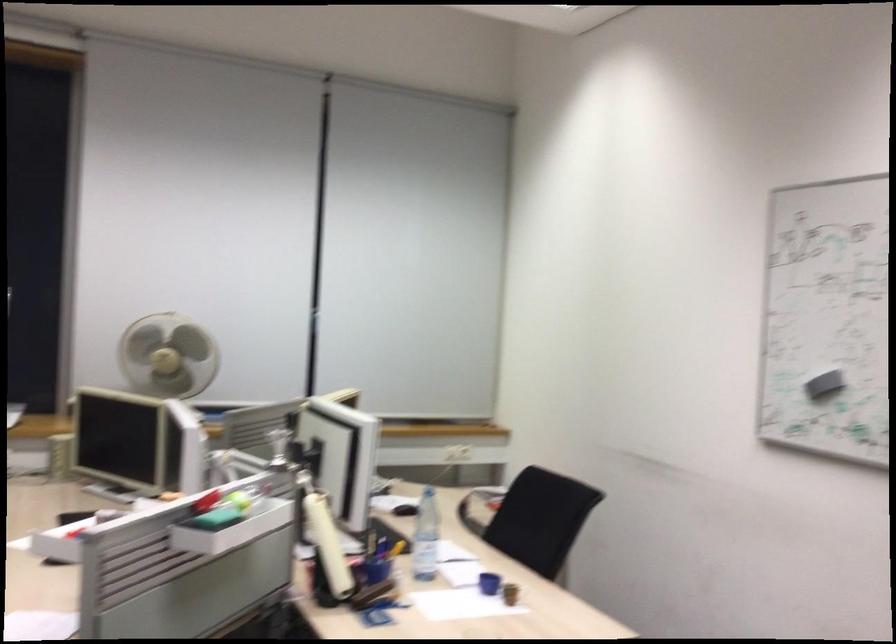
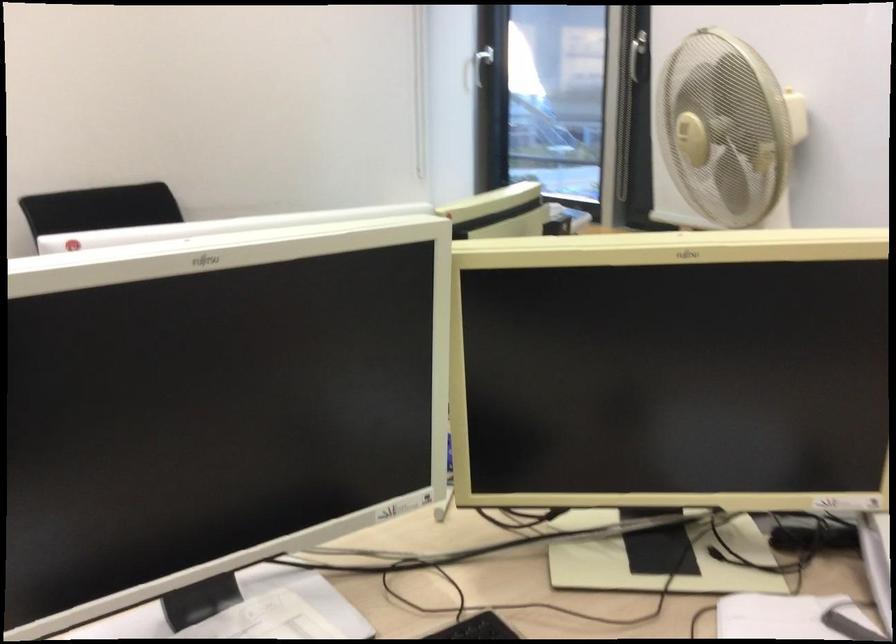
Locate, in the second image, the point that corresponds to point (142, 357) in the first image.

(685, 129)